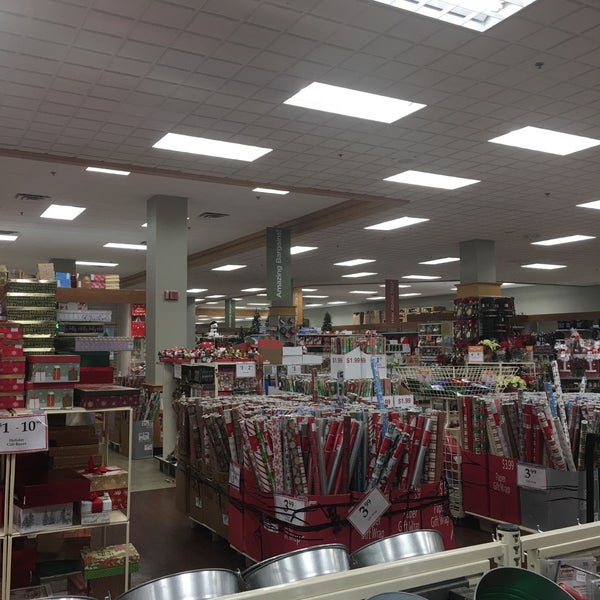
Find the location of a particular element. The image size is (600, 600). tan shelves is located at coordinates (273, 589).